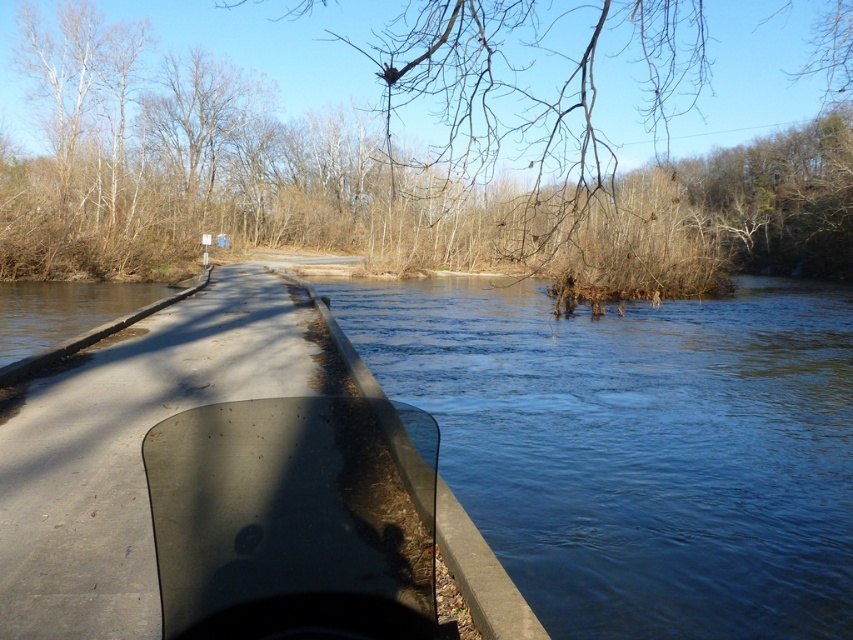
You are standing at the point marked by coordinates point [637,448] in the image. Looking around, you see clear blue water at center. What direction should you walk to reach the dense area of leafless trees on the left side of the path?

Since the point [637,448] corresponds to the clear blue water at center, and the dense area of leafless trees is on the left side of the path, you should walk towards the left to reach them.

You are a bird flying over the river and want to land on the transparent plastic boat at center. Can you land safely without hitting the brown leafless branches at upper center?

The brown leafless branches at upper center are taller than the transparent plastic boat at center, so the bird should be able to land safely on the transparent plastic boat at center without hitting the branches.

You are a bird flying over the river and want to land on the transparent plastic boat at center. However, there are brown leafless branches at upper center in the way. Can you safely land on the boat without hitting the branches?

The brown leafless branches at upper center are above the transparent plastic boat at center, so you can safely land on the boat without hitting the branches by flying underneath them.